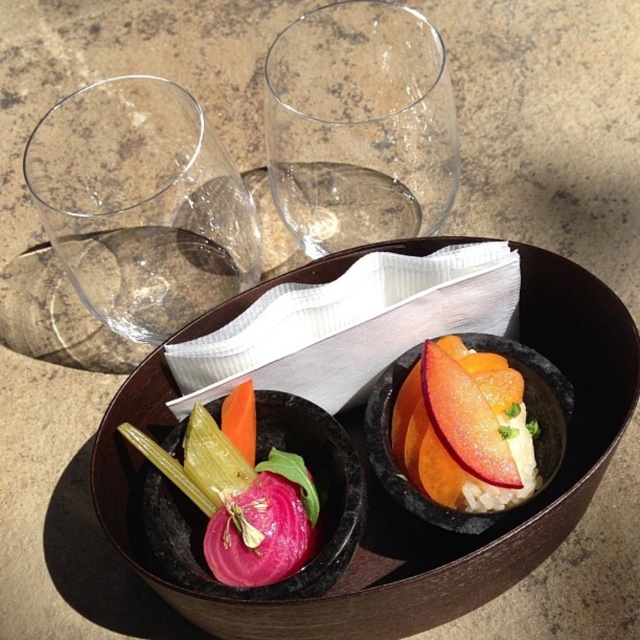
Between black stone bowl at center and transparent glass at upper center, which one is positioned lower?

black stone bowl at center

Does black stone bowl at center have a lesser width compared to transparent glass at upper center?

In fact, black stone bowl at center might be wider than transparent glass at upper center.

You are a GUI agent. You are given a task and a screenshot of the screen. Output one action in this format:
    pyautogui.click(x=<x>, y=<y>)
    Task: Click on the black stone bowl at center
    Image resolution: width=640 pixels, height=640 pixels.
    Given the screenshot: What is the action you would take?
    pyautogui.click(x=396, y=502)

Locate an element on the screen. The height and width of the screenshot is (640, 640). black stone bowl at center is located at coordinates (396, 502).

Between point (588, 368) and point (160, 147), which one is positioned behind?

Positioned behind is point (160, 147).

Can you confirm if black stone bowl at center is bigger than transparent glass at upper left?

Indeed, black stone bowl at center has a larger size compared to transparent glass at upper left.

You are a GUI agent. You are given a task and a screenshot of the screen. Output one action in this format:
    pyautogui.click(x=<x>, y=<y>)
    Task: Click on the black stone bowl at center
    The image size is (640, 640).
    Given the screenshot: What is the action you would take?
    pyautogui.click(x=396, y=502)

Between point (212, 442) and point (529, 353), which one is positioned in front?

Point (212, 442) is more forward.

Find the location of `pink glossy radish at center`. pink glossy radish at center is located at coordinates (241, 493).